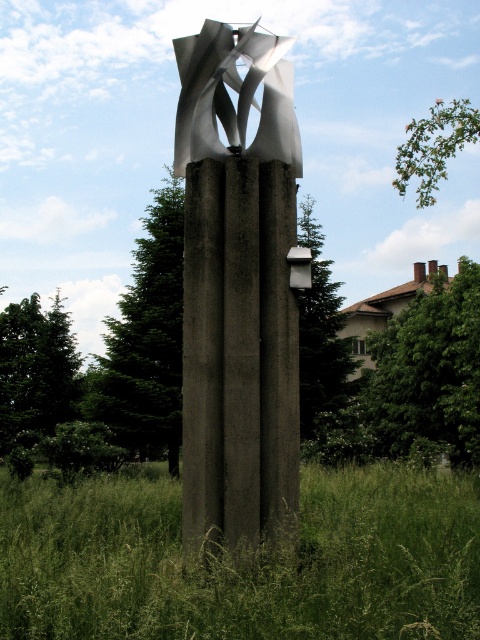
Question: Is green grass at lower center thinner than metallic silver sculpture at center?

Choices:
 (A) yes
 (B) no

Answer: (A)

Question: Which object is the farthest from the polished silver sculpture at center?

Choices:
 (A) metallic silver sculpture at center
 (B) green grass at lower center

Answer: (A)

Question: Does green grass at lower center appear over polished silver sculpture at center?

Choices:
 (A) yes
 (B) no

Answer: (B)

Question: Which of these objects is positioned farthest from the polished silver sculpture at center?

Choices:
 (A) metallic silver sculpture at center
 (B) green grass at lower center

Answer: (A)

Question: Does green grass at lower center have a smaller size compared to polished silver sculpture at center?

Choices:
 (A) yes
 (B) no

Answer: (A)

Question: Among these points, which one is nearest to the camera?

Choices:
 (A) (237, 129)
 (B) (359, 576)
 (C) (275, 333)

Answer: (B)